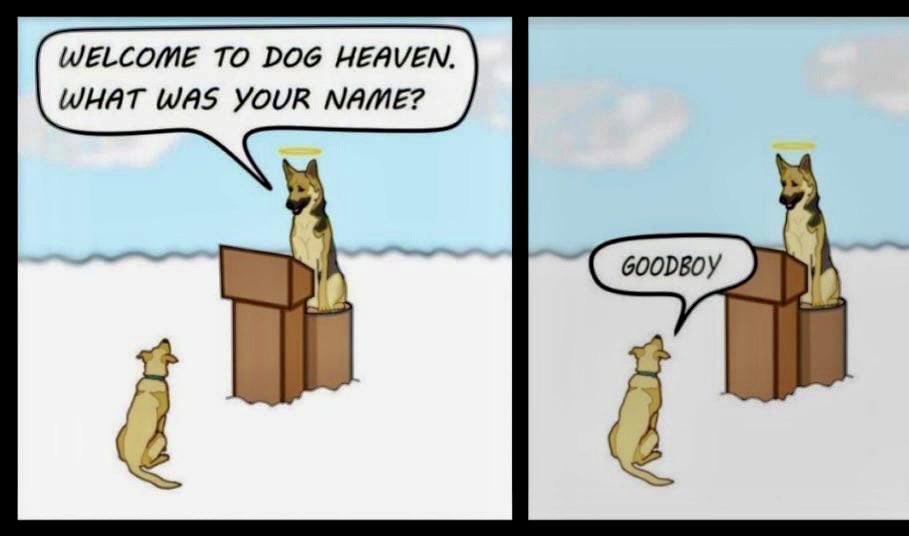
In order to click on front of podium in this screenshot , I will do `click(752, 329)`, `click(263, 334)`.